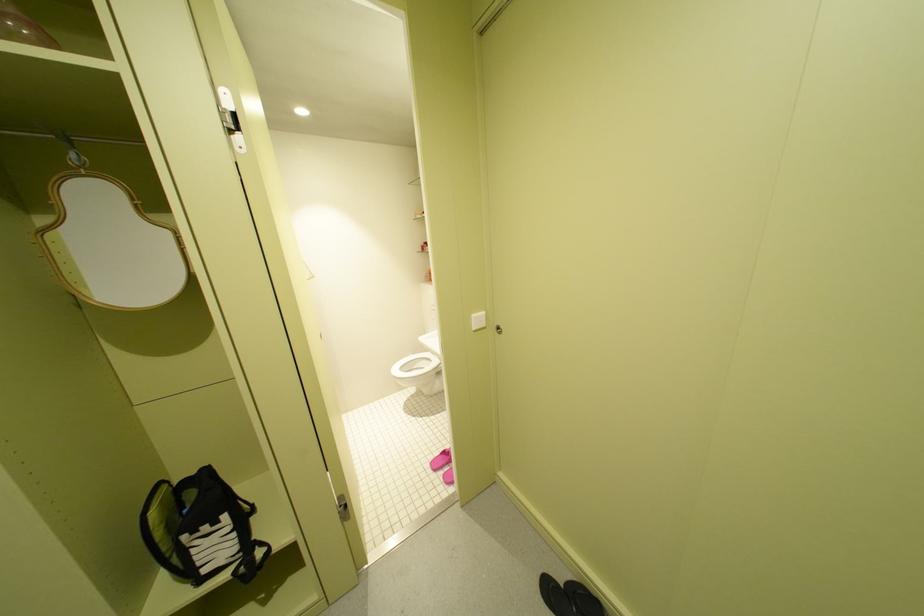
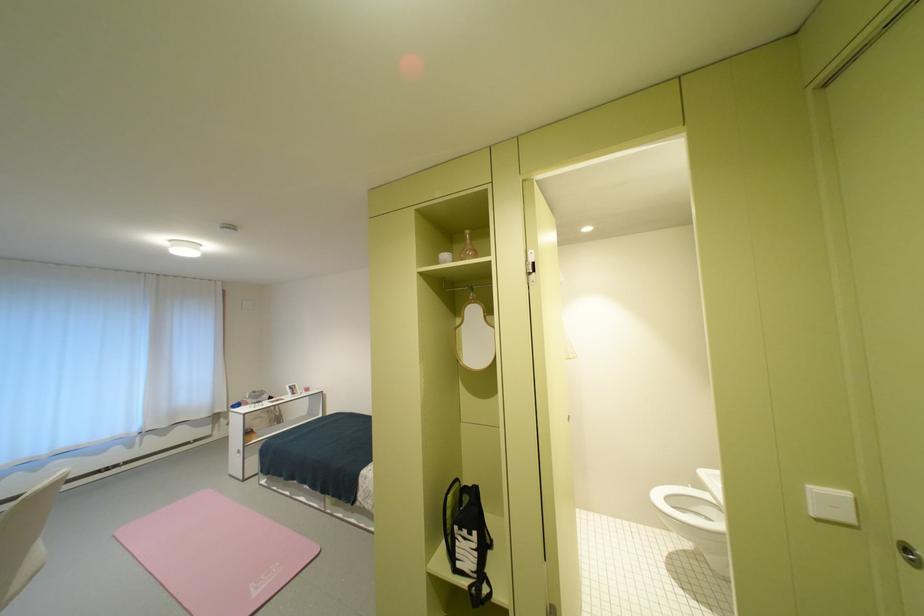
The point at (507, 330) is marked in the first image. Where is the corresponding point in the second image?

(917, 551)